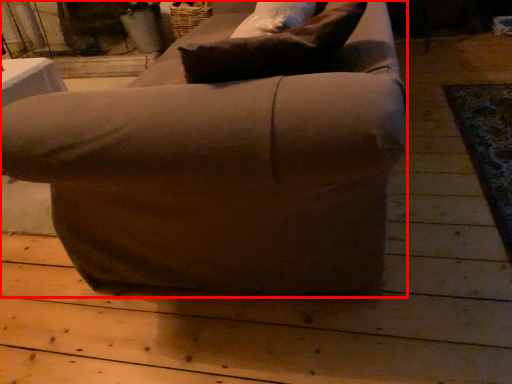
Question: From the image's perspective, where is chair (annotated by the red box) located in relation to pillow in the image?

Choices:
 (A) above
 (B) below

Answer: (A)